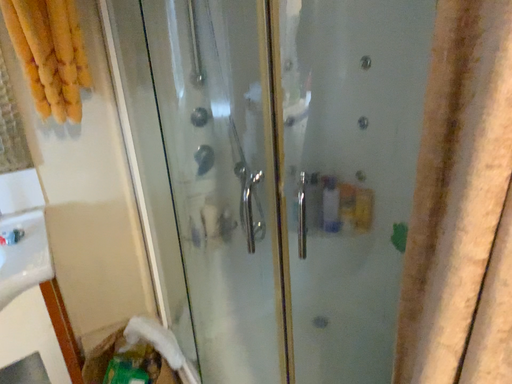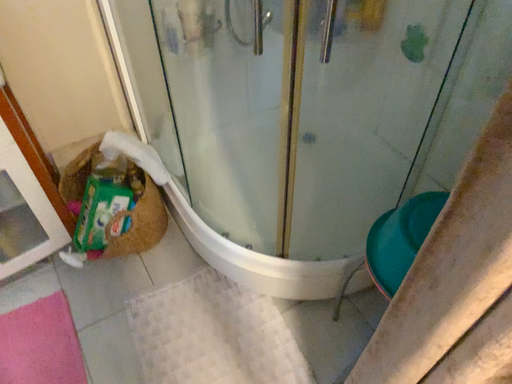
Question: Which way did the camera rotate in the video?

Choices:
 (A) rotated downward
 (B) rotated upward

Answer: (A)